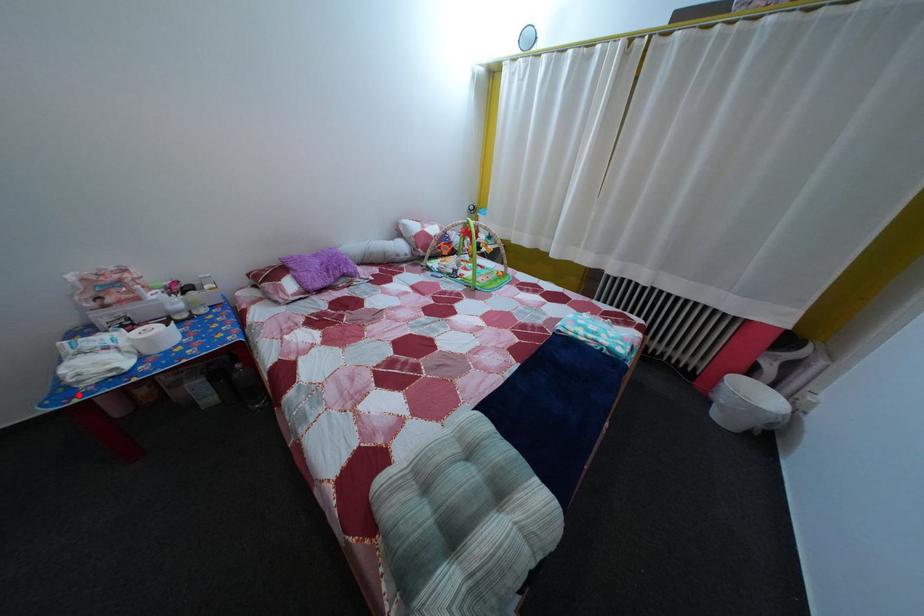
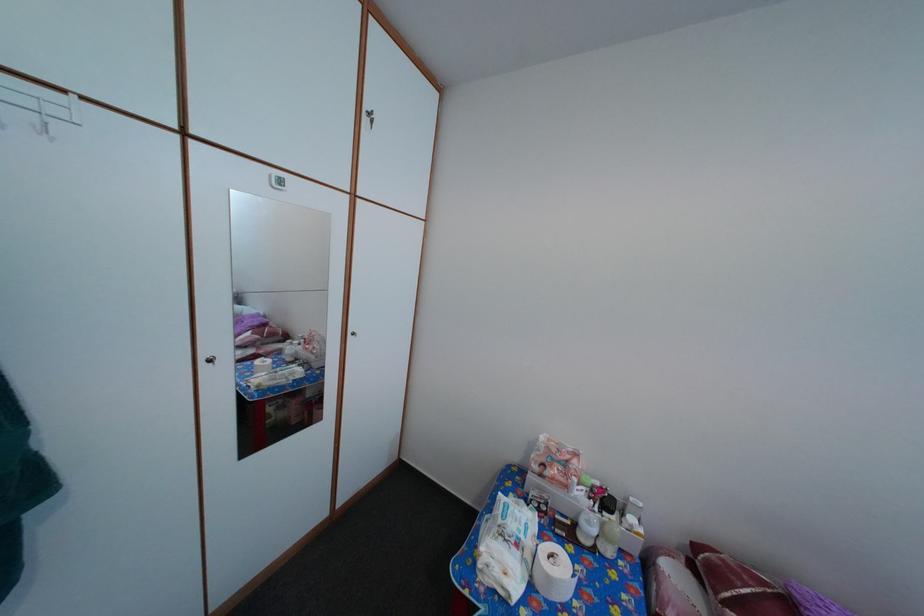
Question: I am providing you with two images of the same scene from different viewpoints. A red point is marked on the first image. At the location where the point appears in image 1, is it still visible in image 2?

Choices:
 (A) Yes
 (B) No

Answer: (A)